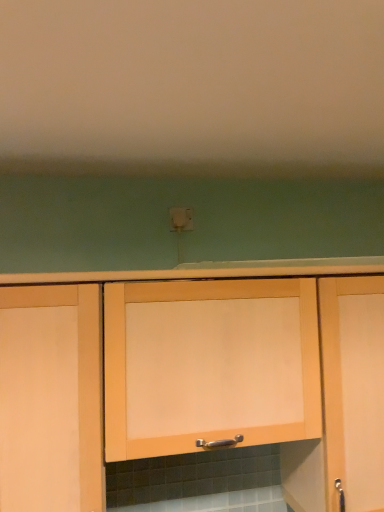
This screenshot has height=512, width=384. I want to click on light wood cabinet at center, acting as the 2th cabinetry starting from the right, so [209, 364].

Locate an element on the screen. matte wood cabinet at left, the first cabinetry when ordered from left to right is located at coordinates (51, 399).

Does point (364, 316) come closer to viewer compared to point (184, 213)?

Yes, it is in front of point (184, 213).

Considering the relative sizes of light wood cabinet at center, acting as the third cabinetry starting from the left, and white plastic electric outlet at center in the image provided, is light wood cabinet at center, acting as the third cabinetry starting from the left, thinner than white plastic electric outlet at center?

No, light wood cabinet at center, acting as the third cabinetry starting from the left, is not thinner than white plastic electric outlet at center.

Is light wood cabinet at center, the 1th cabinetry when ordered from right to left, in contact with white plastic electric outlet at center?

There is a gap between light wood cabinet at center, the 1th cabinetry when ordered from right to left, and white plastic electric outlet at center.

Which is more to the right, light wood cabinet at center, the 1th cabinetry when ordered from right to left, or white plastic electric outlet at center?

Positioned to the right is light wood cabinet at center, the 1th cabinetry when ordered from right to left.

Where is `electric outlet located behind the light wood cabinet at center, the 2th cabinetry from the left`? This screenshot has height=512, width=384. electric outlet located behind the light wood cabinet at center, the 2th cabinetry from the left is located at coordinates (180, 219).

Which is behind, point (181, 221) or point (226, 436)?

Positioned behind is point (181, 221).

Is white plastic electric outlet at center not close to light wood cabinet at center, the 2th cabinetry from the left?

No, white plastic electric outlet at center is not far from light wood cabinet at center, the 2th cabinetry from the left.

Based on the photo, from the image's perspective, is white plastic electric outlet at center under light wood cabinet at center, the 2th cabinetry from the left?

No, from the image's perspective, white plastic electric outlet at center is not beneath light wood cabinet at center, the 2th cabinetry from the left.

Who is smaller, light wood cabinet at center, acting as the 2th cabinetry starting from the right, or white plastic electric outlet at center?

white plastic electric outlet at center.

In terms of height, does light wood cabinet at center, acting as the 2th cabinetry starting from the right, look taller or shorter compared to white plastic electric outlet at center?

Considering their sizes, light wood cabinet at center, acting as the 2th cabinetry starting from the right, has more height than white plastic electric outlet at center.

Between light wood cabinet at center, acting as the 2th cabinetry starting from the right, and white plastic electric outlet at center, which one appears on the left side from the viewer's perspective?

From the viewer's perspective, white plastic electric outlet at center appears more on the left side.

Does light wood cabinet at center, the 2th cabinetry from the left, turn towards white plastic electric outlet at center?

No, light wood cabinet at center, the 2th cabinetry from the left, is not facing towards white plastic electric outlet at center.

Does light wood cabinet at center, acting as the third cabinetry starting from the left, have a greater height compared to matte wood cabinet at left, the 3th cabinetry in the right-to-left sequence?

Yes.

Image resolution: width=384 pixels, height=512 pixels. Identify the location of the 2nd cabinetry to the left when counting from the light wood cabinet at center, acting as the third cabinetry starting from the left. (51, 399).

From a real-world perspective, does light wood cabinet at center, acting as the third cabinetry starting from the left, stand above matte wood cabinet at left, the 3th cabinetry in the right-to-left sequence?

No, from a real-world perspective, light wood cabinet at center, acting as the third cabinetry starting from the left, is not above matte wood cabinet at left, the 3th cabinetry in the right-to-left sequence.

Could you tell me if light wood cabinet at center, acting as the third cabinetry starting from the left, is facing matte wood cabinet at left, the 3th cabinetry in the right-to-left sequence?

No, light wood cabinet at center, acting as the third cabinetry starting from the left, does not turn towards matte wood cabinet at left, the 3th cabinetry in the right-to-left sequence.

From the image's perspective, which one is positioned lower, light wood cabinet at center, the 1th cabinetry when ordered from right to left, or light wood cabinet at center, the 2th cabinetry from the left?

light wood cabinet at center, the 1th cabinetry when ordered from right to left, from the image's perspective.

Does light wood cabinet at center, acting as the third cabinetry starting from the left, come behind light wood cabinet at center, acting as the 2th cabinetry starting from the right?

Yes, it is behind light wood cabinet at center, acting as the 2th cabinetry starting from the right.

From a real-world perspective, is light wood cabinet at center, acting as the third cabinetry starting from the left, physically below light wood cabinet at center, the 2th cabinetry from the left?

Yes.

Which object is positioned more to the left, light wood cabinet at center, acting as the third cabinetry starting from the left, or light wood cabinet at center, acting as the 2th cabinetry starting from the right?

light wood cabinet at center, acting as the 2th cabinetry starting from the right.

The image size is (384, 512). I want to click on the 1st cabinetry in front of the white plastic electric outlet at center, counting from the anchor's position, so click(x=353, y=388).

Which of these two, white plastic electric outlet at center or light wood cabinet at center, the 1th cabinetry when ordered from right to left, is bigger?

light wood cabinet at center, the 1th cabinetry when ordered from right to left, is bigger.

Can we say white plastic electric outlet at center lies outside light wood cabinet at center, the 1th cabinetry when ordered from right to left?

Indeed, white plastic electric outlet at center is completely outside light wood cabinet at center, the 1th cabinetry when ordered from right to left.

Is matte wood cabinet at left, the 3th cabinetry in the right-to-left sequence, taller than light wood cabinet at center, acting as the third cabinetry starting from the left?

No, matte wood cabinet at left, the 3th cabinetry in the right-to-left sequence, is not taller than light wood cabinet at center, acting as the third cabinetry starting from the left.

Can you tell me how much matte wood cabinet at left, the first cabinetry when ordered from left to right, and light wood cabinet at center, acting as the third cabinetry starting from the left, differ in facing direction?

They differ by 8.79e-05 degrees in their facing directions.

Considering the relative sizes of matte wood cabinet at left, the 3th cabinetry in the right-to-left sequence, and light wood cabinet at center, acting as the third cabinetry starting from the left, in the image provided, is matte wood cabinet at left, the 3th cabinetry in the right-to-left sequence, bigger than light wood cabinet at center, acting as the third cabinetry starting from the left,?

Actually, matte wood cabinet at left, the 3th cabinetry in the right-to-left sequence, might be smaller than light wood cabinet at center, acting as the third cabinetry starting from the left.

From the image's perspective, between matte wood cabinet at left, the 3th cabinetry in the right-to-left sequence, and light wood cabinet at center, acting as the third cabinetry starting from the left, which one is located above?

From the image's view, matte wood cabinet at left, the 3th cabinetry in the right-to-left sequence, is above.

Locate an element on the screen. electric outlet to the left of light wood cabinet at center, the 1th cabinetry when ordered from right to left is located at coordinates (180, 219).

Find the location of a particular element. The width and height of the screenshot is (384, 512). the 1st cabinetry located beneath the white plastic electric outlet at center (from a real-world perspective) is located at coordinates click(209, 364).

From the image, which object appears to be farther from white plastic electric outlet at center, light wood cabinet at center, the 1th cabinetry when ordered from right to left, or light wood cabinet at center, acting as the 2th cabinetry starting from the right?

Among the two, light wood cabinet at center, the 1th cabinetry when ordered from right to left, is located further to white plastic electric outlet at center.

Which object lies nearer to the anchor point matte wood cabinet at left, the first cabinetry when ordered from left to right, light wood cabinet at center, acting as the third cabinetry starting from the left, or white plastic electric outlet at center?

white plastic electric outlet at center is positioned closer to the anchor matte wood cabinet at left, the first cabinetry when ordered from left to right.

From the image, which object appears to be nearer to light wood cabinet at center, acting as the third cabinetry starting from the left, matte wood cabinet at left, the first cabinetry when ordered from left to right, or white plastic electric outlet at center?

Based on the image, white plastic electric outlet at center appears to be nearer to light wood cabinet at center, acting as the third cabinetry starting from the left.

When comparing their distances from light wood cabinet at center, acting as the third cabinetry starting from the left, does light wood cabinet at center, the 2th cabinetry from the left, or white plastic electric outlet at center seem closer?

light wood cabinet at center, the 2th cabinetry from the left.

Estimate the real-world distances between objects in this image. Which object is further from light wood cabinet at center, acting as the 2th cabinetry starting from the right, light wood cabinet at center, acting as the third cabinetry starting from the left, or white plastic electric outlet at center?

white plastic electric outlet at center is positioned further to the anchor light wood cabinet at center, acting as the 2th cabinetry starting from the right.

Considering their positions, is light wood cabinet at center, acting as the 2th cabinetry starting from the right, positioned further to white plastic electric outlet at center than light wood cabinet at center, acting as the third cabinetry starting from the left?

light wood cabinet at center, acting as the third cabinetry starting from the left, lies further to white plastic electric outlet at center than the other object.

Looking at the image, which one is located further to light wood cabinet at center, the 2th cabinetry from the left, matte wood cabinet at left, the first cabinetry when ordered from left to right, or white plastic electric outlet at center?

Based on the image, white plastic electric outlet at center appears to be further to light wood cabinet at center, the 2th cabinetry from the left.

Based on their spatial positions, is light wood cabinet at center, the 2th cabinetry from the left, or white plastic electric outlet at center closer to matte wood cabinet at left, the 3th cabinetry in the right-to-left sequence?

light wood cabinet at center, the 2th cabinetry from the left, lies closer to matte wood cabinet at left, the 3th cabinetry in the right-to-left sequence, than the other object.

Locate an element on the screen. This screenshot has height=512, width=384. electric outlet situated between matte wood cabinet at left, the 3th cabinetry in the right-to-left sequence, and light wood cabinet at center, the 1th cabinetry when ordered from right to left, from left to right is located at coordinates (180, 219).

This screenshot has height=512, width=384. In order to click on cabinetry between white plastic electric outlet at center and matte wood cabinet at left, the 3th cabinetry in the right-to-left sequence, in the up-down direction in this screenshot , I will do `click(209, 364)`.

Locate an element on the screen. The width and height of the screenshot is (384, 512). cabinetry located between matte wood cabinet at left, the first cabinetry when ordered from left to right, and light wood cabinet at center, the 1th cabinetry when ordered from right to left, in the left-right direction is located at coordinates (209, 364).

I want to click on cabinetry between white plastic electric outlet at center and light wood cabinet at center, acting as the third cabinetry starting from the left, so click(x=209, y=364).